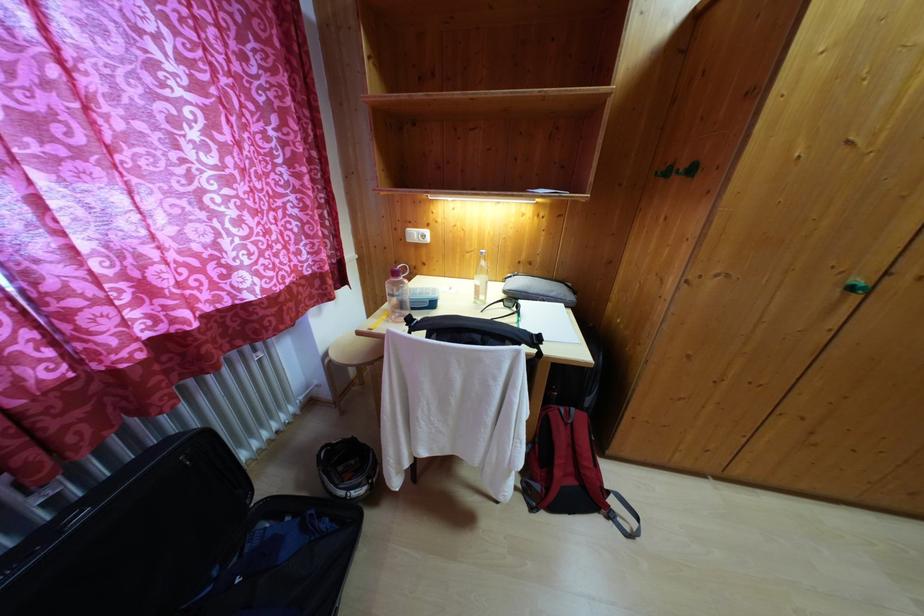
Where is `black motorcycle helmet`? black motorcycle helmet is located at coordinates (346, 468).